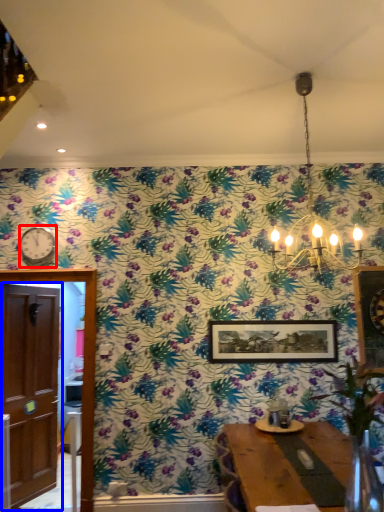
Question: Which point is closer to the camera, clock (highlighted by a red box) or door (highlighted by a blue box)?

Choices:
 (A) clock
 (B) door

Answer: (B)